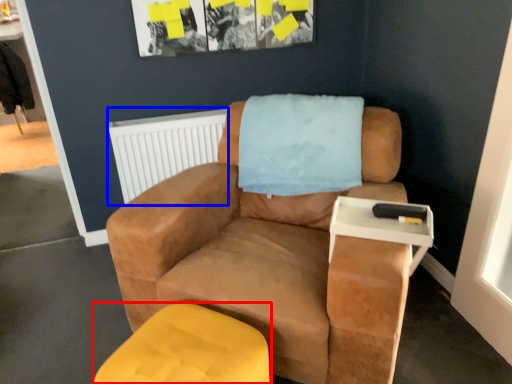
Question: Which point is closer to the camera, furniture (highlighted by a red box) or radiator (highlighted by a blue box)?

Choices:
 (A) furniture
 (B) radiator

Answer: (A)